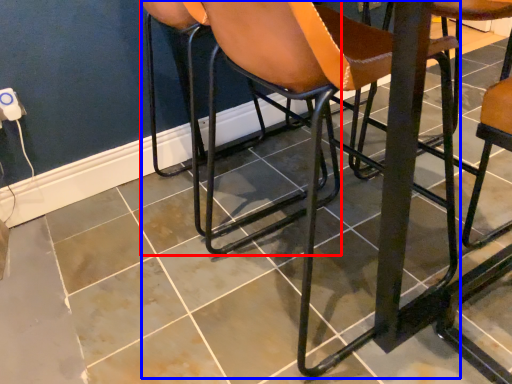
Question: Which object is closer to the camera taking this photo, chair (highlighted by a red box) or chair (highlighted by a blue box)?

Choices:
 (A) chair
 (B) chair

Answer: (B)